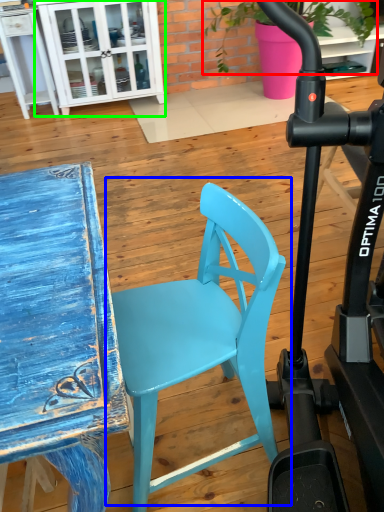
Question: Which is farther away from plant (highlighted by a red box)? chair (highlighted by a blue box) or cabinetry (highlighted by a green box)?

Choices:
 (A) chair
 (B) cabinetry

Answer: (A)